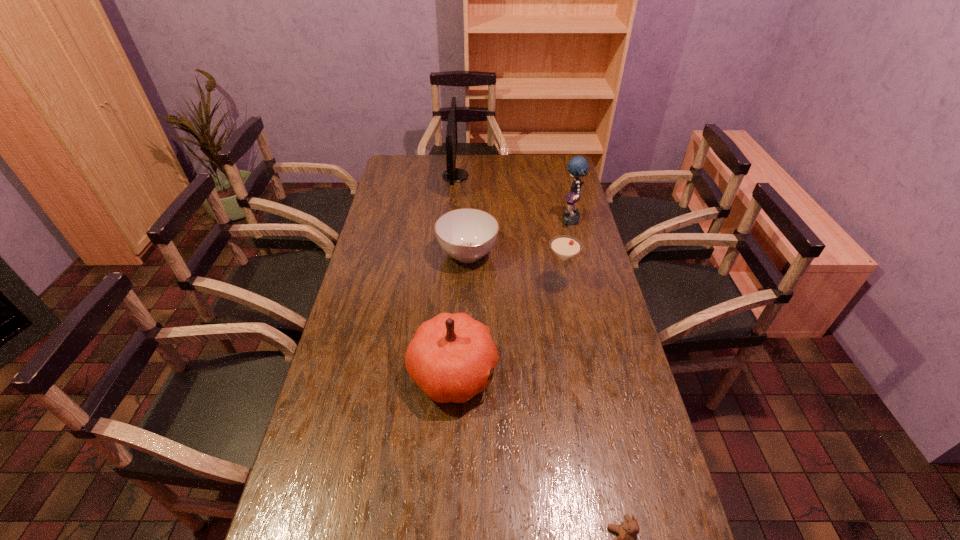
At what (x,y) coordinates should I click in order to perform the action: click on computer monitor. Please return your answer as a coordinate pair (x, y). Image resolution: width=960 pixels, height=540 pixels. Looking at the image, I should click on (452, 174).

Where is `rag doll`? rag doll is located at coordinates (577, 166).

The image size is (960, 540). Find the location of `pumpkin`. pumpkin is located at coordinates (450, 357).

Locate an element on the screen. the fourth shortest object is located at coordinates (450, 357).

This screenshot has width=960, height=540. Identify the location of the fourth tallest object. (565, 247).

I want to click on the second shortest object, so [467, 234].

The width and height of the screenshot is (960, 540). I want to click on vacant position located on the front-facing side of the farthest object, so click(x=509, y=176).

You are a GUI agent. You are given a task and a screenshot of the screen. Output one action in this format:
    pyautogui.click(x=<x>, y=<y>)
    Task: Click on the vacant space situated on the front-facing side of the rag doll
    The width and height of the screenshot is (960, 540).
    Given the screenshot: What is the action you would take?
    pyautogui.click(x=464, y=222)

Identify the location of vacant space located 0.400m on the front-facing side of the rag doll. (464, 222).

In order to click on vacant region located 0.070m on the front-facing side of the rag doll in this screenshot , I will do `click(543, 222)`.